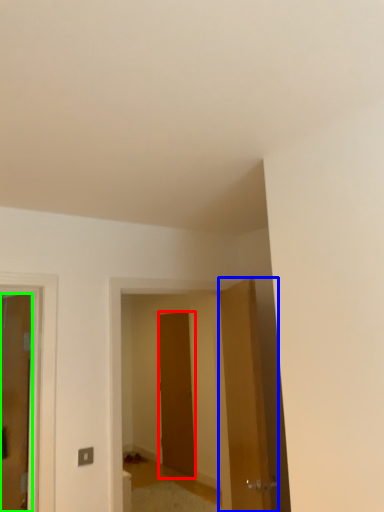
Question: Which object is positioned closest to door (highlighted by a red box)? Select from door (highlighted by a blue box) and door (highlighted by a green box).

Choices:
 (A) door
 (B) door

Answer: (A)